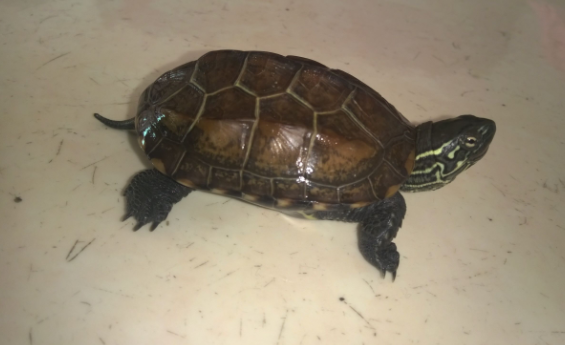
Where is `floor infront of the tortoise`? The height and width of the screenshot is (345, 565). floor infront of the tortoise is located at coordinates pyautogui.click(x=512, y=164).